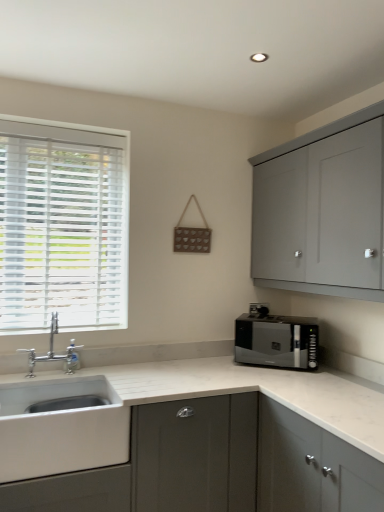
How much space does matte gray cabinet at upper right, positioned as the first cabinetry in right-to-left order, occupy horizontally?

It is 13.97 inches.

Describe the element at coordinates (62, 226) in the screenshot. I see `white wood blinds at left` at that location.

Locate an element on the screen. Image resolution: width=384 pixels, height=512 pixels. silver metallic faucet at left is located at coordinates (53, 351).

Measure the distance between point (81, 346) and camera.

They are 2.31 meters apart.

Measure the distance between shiny black microwave at right and camera.

The distance of shiny black microwave at right from camera is 7.53 feet.

How much space does matte gray cabinet at lower left, which is the 2th cabinetry in top-to-bottom order, occupy vertically?

It is 38.49 inches.

Identify the location of matte gray cabinet at upper right, positioned as the first cabinetry in right-to-left order. This screenshot has height=512, width=384. coord(323,210).

In the image, is matte gray cabinet at upper right, positioned as the first cabinetry in right-to-left order, on the left side or the right side of shiny black microwave at right?

matte gray cabinet at upper right, positioned as the first cabinetry in right-to-left order, is to the right of shiny black microwave at right.

Does point (350, 223) come behind point (318, 328)?

No, it is not.

Does matte gray cabinet at upper right, which is the 1th cabinetry in top-to-bottom order, come behind shiny black microwave at right?

No, matte gray cabinet at upper right, which is the 1th cabinetry in top-to-bottom order, is closer to the viewer.

Is silver metallic faucet at left positioned far away from shiny black microwave at right?

Yes.

Consider the image. Which is more to the left, silver metallic faucet at left or shiny black microwave at right?

silver metallic faucet at left.

From the image's perspective, does silver metallic faucet at left appear lower than shiny black microwave at right?

No, from the image's perspective, silver metallic faucet at left is not beneath shiny black microwave at right.

Which of these two, silver metallic faucet at left or shiny black microwave at right, is smaller?

silver metallic faucet at left is smaller.

Based on the photo, which object is further away from the camera taking this photo, matte gray cabinet at lower left, which is the 2th cabinetry in top-to-bottom order, or shiny black microwave at right?

shiny black microwave at right is further away from the camera.

Considering the sizes of objects matte gray cabinet at lower left, which appears as the first cabinetry when ordered from the bottom, and shiny black microwave at right in the image provided, who is shorter, matte gray cabinet at lower left, which appears as the first cabinetry when ordered from the bottom, or shiny black microwave at right?

Standing shorter between the two is shiny black microwave at right.

Is matte gray cabinet at lower left, which is the 2th cabinetry in top-to-bottom order, touching shiny black microwave at right?

matte gray cabinet at lower left, which is the 2th cabinetry in top-to-bottom order, and shiny black microwave at right are not in contact.

Is matte gray cabinet at lower left, acting as the 2th cabinetry starting from the right, facing away from shiny black microwave at right?

No, matte gray cabinet at lower left, acting as the 2th cabinetry starting from the right, is not facing the opposite direction of shiny black microwave at right.

Can you confirm if silver metallic faucet at left is wider than matte gray cabinet at lower left, acting as the 2th cabinetry starting from the right?

No, silver metallic faucet at left is not wider than matte gray cabinet at lower left, acting as the 2th cabinetry starting from the right.

Who is taller, silver metallic faucet at left or matte gray cabinet at lower left, which appears as the first cabinetry when ordered from the bottom?

matte gray cabinet at lower left, which appears as the first cabinetry when ordered from the bottom.

Relative to matte gray cabinet at lower left, which appears as the first cabinetry when ordered from the bottom, is silver metallic faucet at left in front or behind?

Visually, silver metallic faucet at left is located behind matte gray cabinet at lower left, which appears as the first cabinetry when ordered from the bottom.

Is silver metallic faucet at left positioned with its back to matte gray cabinet at lower left, acting as the 2th cabinetry starting from the right?

silver metallic faucet at left does not have its back to matte gray cabinet at lower left, acting as the 2th cabinetry starting from the right.

How much distance is there between matte gray cabinet at upper right, positioned as the first cabinetry in right-to-left order, and white ceramic sink at lower left?

matte gray cabinet at upper right, positioned as the first cabinetry in right-to-left order, is 1.32 meters from white ceramic sink at lower left.

Is matte gray cabinet at upper right, which ranks as the 2th cabinetry in bottom-to-top order, positioned with its back to white ceramic sink at lower left?

No, matte gray cabinet at upper right, which ranks as the 2th cabinetry in bottom-to-top order,'s orientation is not away from white ceramic sink at lower left.

Can you confirm if matte gray cabinet at upper right, which ranks as the 2th cabinetry in bottom-to-top order, is bigger than white ceramic sink at lower left?

Yes, matte gray cabinet at upper right, which ranks as the 2th cabinetry in bottom-to-top order, is bigger than white ceramic sink at lower left.

Can white ceramic sink at lower left be found inside matte gray cabinet at upper right, which is the 1th cabinetry in top-to-bottom order?

No.

Would you consider shiny black microwave at right to be distant from white wood blinds at left?

Yes, shiny black microwave at right is far from white wood blinds at left.

Based on the photo, considering the relative sizes of shiny black microwave at right and white wood blinds at left in the image provided, is shiny black microwave at right bigger than white wood blinds at left?

Incorrect, shiny black microwave at right is not larger than white wood blinds at left.

Is shiny black microwave at right facing towards white wood blinds at left?

No, shiny black microwave at right is not facing towards white wood blinds at left.

How much distance is there between white ceramic sink at lower left and silver metallic faucet at left?

A distance of 10.49 inches exists between white ceramic sink at lower left and silver metallic faucet at left.

Considering the positions of objects white ceramic sink at lower left and silver metallic faucet at left in the image provided, who is in front, white ceramic sink at lower left or silver metallic faucet at left?

white ceramic sink at lower left is more forward.

Based on the photo, is white ceramic sink at lower left next to silver metallic faucet at left and touching it?

No, white ceramic sink at lower left is not with silver metallic faucet at left.

Can we say white ceramic sink at lower left lies outside silver metallic faucet at left?

white ceramic sink at lower left lies outside silver metallic faucet at left's area.

Locate an element on the screen. microwave oven on the left of the matte gray cabinet at upper right, which ranks as the 2th cabinetry in bottom-to-top order is located at coordinates (277, 341).

Find the location of a particular element. Image resolution: width=384 pixels, height=512 pixels. microwave oven behind the silver metallic faucet at left is located at coordinates click(277, 341).

From the image, which object appears to be nearer to shiny black microwave at right, white ceramic sink at lower left or white wood blinds at left?

The object closer to shiny black microwave at right is white ceramic sink at lower left.

Which object lies nearer to the anchor point matte gray cabinet at lower left, which is the 2th cabinetry in top-to-bottom order, silver metallic faucet at left or white wood blinds at left?

The object closer to matte gray cabinet at lower left, which is the 2th cabinetry in top-to-bottom order, is silver metallic faucet at left.

Based on their spatial positions, is silver metallic faucet at left or white wood blinds at left further from matte gray cabinet at upper right, which ranks as the 2th cabinetry in bottom-to-top order?

silver metallic faucet at left lies further to matte gray cabinet at upper right, which ranks as the 2th cabinetry in bottom-to-top order, than the other object.

When comparing their distances from silver metallic faucet at left, does white wood blinds at left or matte gray cabinet at lower left, which appears as the first cabinetry when ordered from the bottom, seem closer?

white wood blinds at left.

When comparing their distances from matte gray cabinet at upper right, the second cabinetry positioned from the left, does matte gray cabinet at lower left, which is the 2th cabinetry in top-to-bottom order, or white wood blinds at left seem further?

white wood blinds at left is positioned further to the anchor matte gray cabinet at upper right, the second cabinetry positioned from the left.

Estimate the real-world distances between objects in this image. Which object is further from matte gray cabinet at upper right, which ranks as the 2th cabinetry in bottom-to-top order, white wood blinds at left or silver metallic faucet at left?

Among the two, silver metallic faucet at left is located further to matte gray cabinet at upper right, which ranks as the 2th cabinetry in bottom-to-top order.

When comparing their distances from matte gray cabinet at upper right, the second cabinetry positioned from the left, does white ceramic sink at lower left or silver metallic faucet at left seem further?

Among the two, silver metallic faucet at left is located further to matte gray cabinet at upper right, the second cabinetry positioned from the left.

From the image, which object appears to be farther from silver metallic faucet at left, white ceramic sink at lower left or shiny black microwave at right?

Among the two, shiny black microwave at right is located further to silver metallic faucet at left.

Find the location of a particular element. microwave oven between white wood blinds at left and matte gray cabinet at upper right, which is the 1th cabinetry in top-to-bottom order, from left to right is located at coordinates (277, 341).

The height and width of the screenshot is (512, 384). What are the coordinates of `microwave oven located between white ceramic sink at lower left and matte gray cabinet at upper right, which ranks as the 2th cabinetry in bottom-to-top order, in the left-right direction` in the screenshot? It's located at (277, 341).

This screenshot has height=512, width=384. Identify the location of sink between silver metallic faucet at left and matte gray cabinet at upper right, the second cabinetry positioned from the left. (60, 421).

You are a GUI agent. You are given a task and a screenshot of the screen. Output one action in this format:
    pyautogui.click(x=<x>, y=<y>)
    Task: Click on the microwave oven located between silver metallic faucet at left and matte gray cabinet at upper right, the second cabinetry positioned from the left, in the left-right direction
    This screenshot has height=512, width=384.
    Given the screenshot: What is the action you would take?
    pyautogui.click(x=277, y=341)